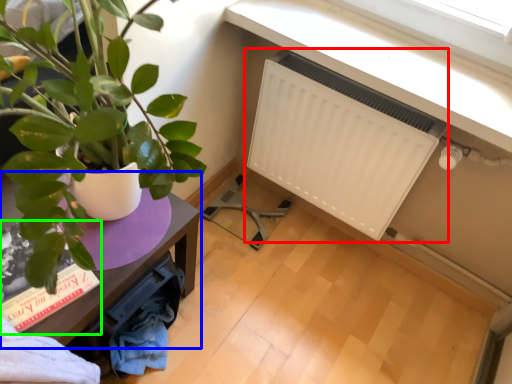
Question: Which is farther away from radiator (highlighted by a red box)? table (highlighted by a blue box) or book (highlighted by a green box)?

Choices:
 (A) table
 (B) book

Answer: (B)